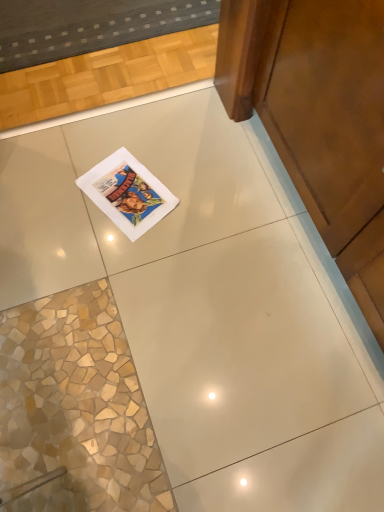
Identify the location of vacant space situated above matte paper magazine at center (from a real-world perspective). (132, 193).